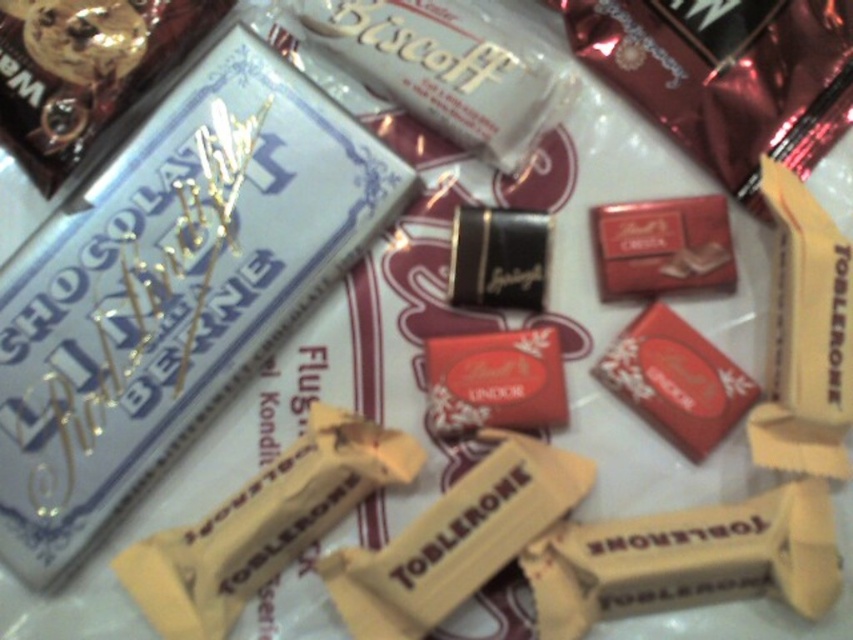
Question: Is shiny red chocolate bar at center to the left of shiny dark chocolate bar at center from the viewer's perspective?

Choices:
 (A) yes
 (B) no

Answer: (B)

Question: Which object appears farthest from the camera in this image?

Choices:
 (A) shiny red chocolate bar at center
 (B) shiny dark chocolate bar at center

Answer: (B)

Question: Among these objects, which one is nearest to the camera?

Choices:
 (A) shiny dark chocolate bar at center
 (B) shiny red chocolate bar at center

Answer: (B)

Question: Which of the following is the farthest from the observer?

Choices:
 (A) shiny dark chocolate bar at center
 (B) shiny red chocolate bar at center

Answer: (A)

Question: Is shiny red chocolate bar at center bigger than shiny dark chocolate bar at center?

Choices:
 (A) yes
 (B) no

Answer: (A)

Question: Is shiny red chocolate bar at center wider than shiny dark chocolate bar at center?

Choices:
 (A) no
 (B) yes

Answer: (B)